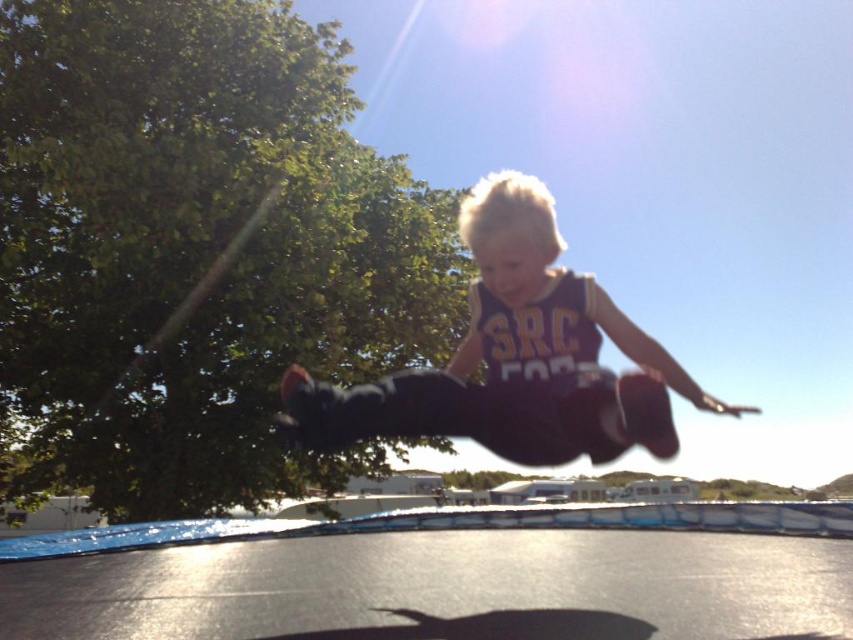
Question: Does black rubber trampoline at center appear on the left side of purple jersey at center?

Choices:
 (A) yes
 (B) no

Answer: (B)

Question: Does black rubber trampoline at center appear on the left side of purple jersey at center?

Choices:
 (A) no
 (B) yes

Answer: (A)

Question: Observing the image, what is the correct spatial positioning of black rubber trampoline at center in reference to purple jersey at center?

Choices:
 (A) right
 (B) left

Answer: (A)

Question: Among these objects, which one is nearest to the camera?

Choices:
 (A) purple jersey at center
 (B) black rubber trampoline at center

Answer: (A)

Question: Which point appears farthest from the camera in this image?

Choices:
 (A) (19, 596)
 (B) (537, 384)

Answer: (A)